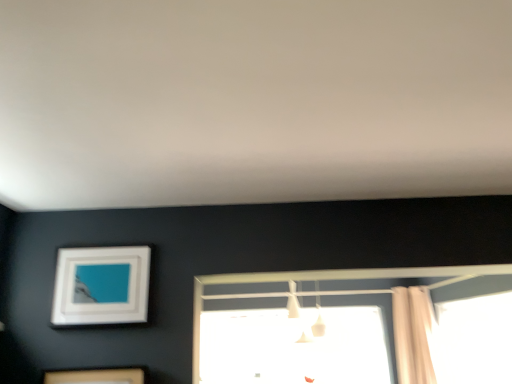
Question: Does point (111, 253) appear closer or farther from the camera than point (248, 336)?

Choices:
 (A) farther
 (B) closer

Answer: (B)

Question: Would you say white glossy picture frame at upper left is to the left or to the right of transparent glass window at center, which is the first window in back-to-front order, in the picture?

Choices:
 (A) left
 (B) right

Answer: (A)

Question: Which of these objects is positioned farthest from the transparent glass window at center, the 1th window viewed from the left?

Choices:
 (A) white matte light fixture at center
 (B) white glossy picture frame at upper left
 (C) transparent glass window at center, arranged as the second window when viewed from the left
 (D) beige fabric shower curtain at right

Answer: (B)

Question: Estimate the real-world distances between objects in this image. Which object is closer to the beige fabric shower curtain at right?

Choices:
 (A) transparent glass window at center, the 1th window in the right-to-left sequence
 (B) white glossy picture frame at upper left
 (C) white matte light fixture at center
 (D) transparent glass window at center, the 1th window viewed from the left

Answer: (A)